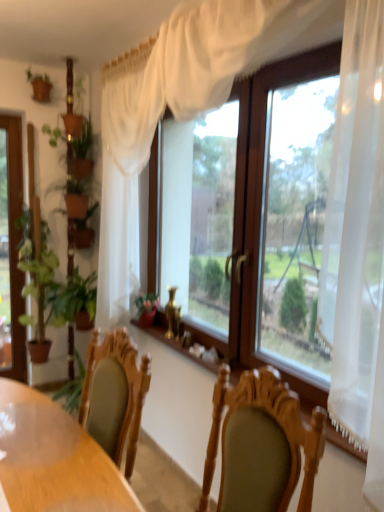
Question: Does transparent glass window at center lie in front of green leafy plant at left?

Choices:
 (A) yes
 (B) no

Answer: (A)

Question: Is transparent glass window at center turned away from green leafy plant at left?

Choices:
 (A) yes
 (B) no

Answer: (B)

Question: From a real-world perspective, is transparent glass window at center positioned under green leafy plant at left based on gravity?

Choices:
 (A) no
 (B) yes

Answer: (A)

Question: Considering the relative sizes of transparent glass window at center and green leafy plant at left in the image provided, is transparent glass window at center bigger than green leafy plant at left?

Choices:
 (A) no
 (B) yes

Answer: (B)

Question: Is transparent glass window at center taller than green leafy plant at left?

Choices:
 (A) yes
 (B) no

Answer: (A)

Question: Considering the relative sizes of transparent glass window at center and green leafy plant at left in the image provided, is transparent glass window at center smaller than green leafy plant at left?

Choices:
 (A) yes
 (B) no

Answer: (B)

Question: Could you tell me if wooden table at center is facing green leafy plant at left?

Choices:
 (A) no
 (B) yes

Answer: (A)

Question: Does wooden table at center appear on the right side of green leafy plant at left?

Choices:
 (A) no
 (B) yes

Answer: (B)

Question: Does wooden table at center lie behind green leafy plant at left?

Choices:
 (A) yes
 (B) no

Answer: (B)

Question: Is wooden table at center facing away from green leafy plant at left?

Choices:
 (A) yes
 (B) no

Answer: (B)

Question: Is green leafy plant at left completely or partially inside wooden table at center?

Choices:
 (A) no
 (B) yes

Answer: (A)

Question: Can you confirm if wooden table at center is shorter than green leafy plant at left?

Choices:
 (A) no
 (B) yes

Answer: (B)

Question: From the image's perspective, is green leafy plant at left under wooden table at center?

Choices:
 (A) no
 (B) yes

Answer: (A)